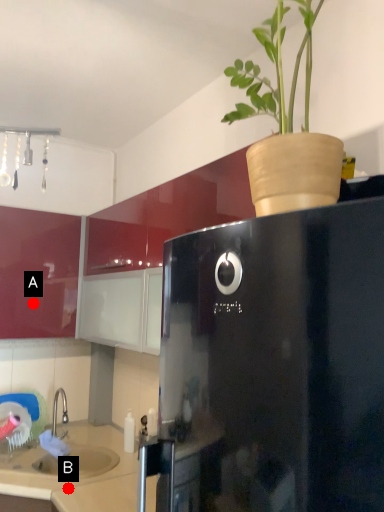
Question: Two points are circled on the image, labeled by A and B beside each circle. Which of the following is the closest to the observer?

Choices:
 (A) A is closer
 (B) B is closer

Answer: (B)